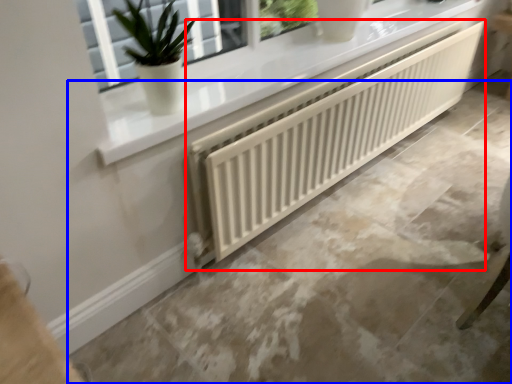
Question: Which point is further to the camera, radiator (highlighted by a red box) or concrete (highlighted by a blue box)?

Choices:
 (A) radiator
 (B) concrete

Answer: (A)